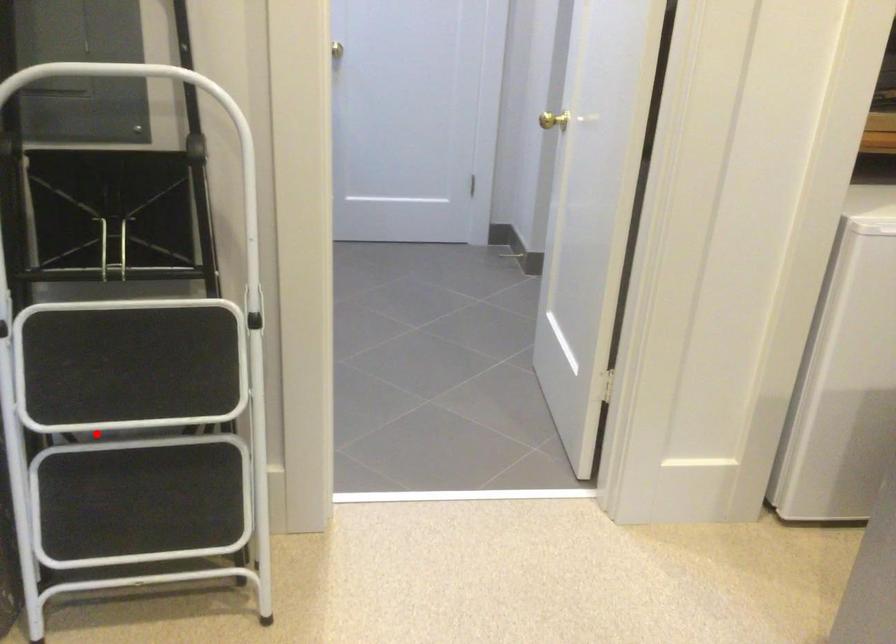
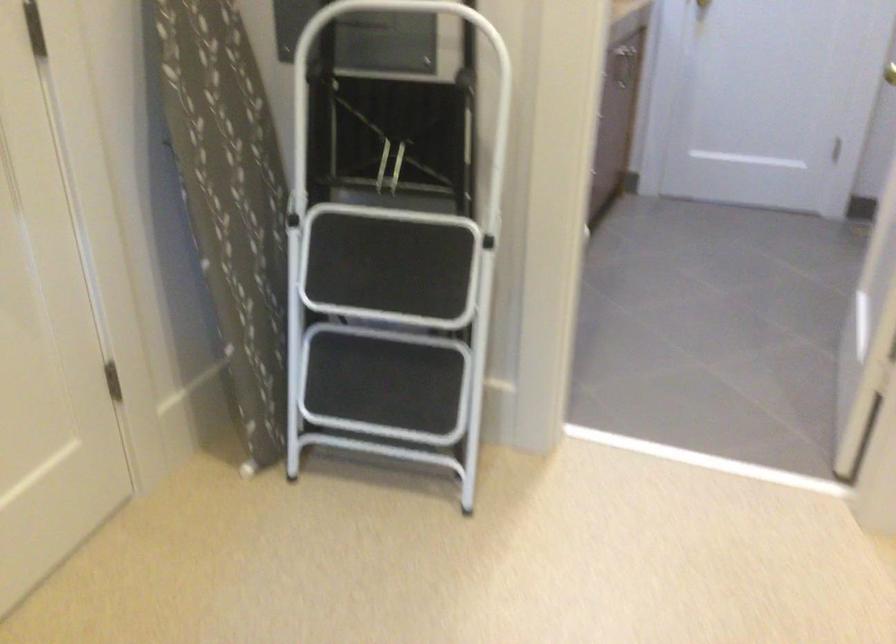
In the second image, find the point that corresponds to the highlighted location in the first image.

(371, 324)